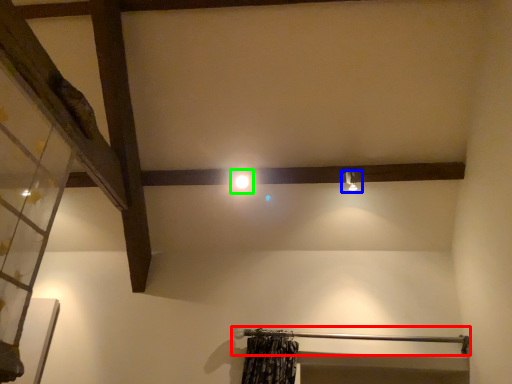
Question: Which is nearer to the beam (highlighted by a red box)? light fixture (highlighted by a blue box) or light (highlighted by a green box).

Choices:
 (A) light fixture
 (B) light

Answer: (A)